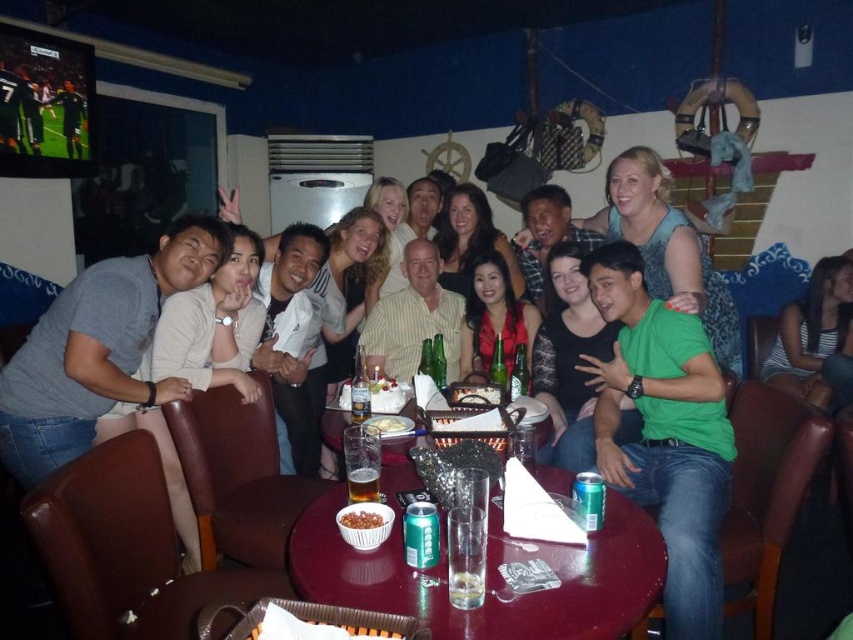
Does striped fabric shirt at right have a greater height compared to matte black dress at center?

Indeed, striped fabric shirt at right has a greater height compared to matte black dress at center.

Where is `striped fabric shirt at right`? striped fabric shirt at right is located at coordinates (813, 333).

Which is in front, point (785, 317) or point (480, 275)?

Positioned in front is point (480, 275).

Identify the location of striped fabric shirt at right. (813, 333).

Who is lower down, smooth wooden table at center or striped fabric shirt at right?

Positioned lower is smooth wooden table at center.

Who is more forward, (494, 627) or (822, 298)?

Positioned in front is point (494, 627).

Does point (315, 586) come farther from viewer compared to point (792, 321)?

No, (315, 586) is in front of (792, 321).

I want to click on smooth wooden table at center, so click(486, 573).

Find the location of a particular element. shiny metallic table at center is located at coordinates (334, 428).

Locate an element on the screen. This screenshot has height=640, width=853. shiny metallic table at center is located at coordinates (334, 428).

Where is `shiny metallic table at center`? The image size is (853, 640). shiny metallic table at center is located at coordinates (334, 428).